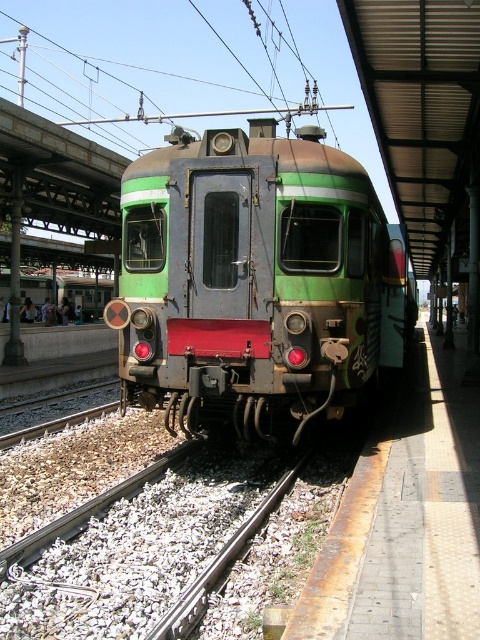
Between rusty metal train at center and gray gravel track at lower left, which one is positioned higher?

rusty metal train at center is higher up.

Does point (303, 193) come behind point (69, 584)?

Yes, point (303, 193) is behind point (69, 584).

You are a GUI agent. You are given a task and a screenshot of the screen. Output one action in this format:
    pyautogui.click(x=<x>, y=<y>)
    Task: Click on the rusty metal train at center
    The height and width of the screenshot is (640, 480).
    Given the screenshot: What is the action you would take?
    pyautogui.click(x=256, y=282)